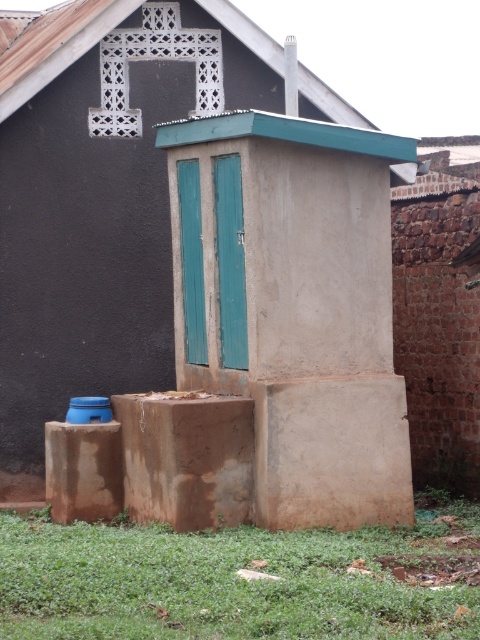
You are a maintenance worker needing to place a 2.5 meter long ladder between the brown mud hut at center and the green grass at lower center. Can the ladder fit horizontally between them without bending?

The distance between the brown mud hut at center and the green grass at lower center is 7.31 meters. Since the ladder is only 2.5 meters long, it can fit horizontally between them without bending.

You are standing in front of a small outdoor structure and notice a brown mud hut at center and green grass at lower center. Which object appears narrower when viewed from your perspective?

The brown mud hut at center appears narrower than the green grass at lower center.

You are standing in a field and see the brown mud hut at center and the green grass at lower center. Which object is taller?

The brown mud hut at center is taller than the green grass at lower center.